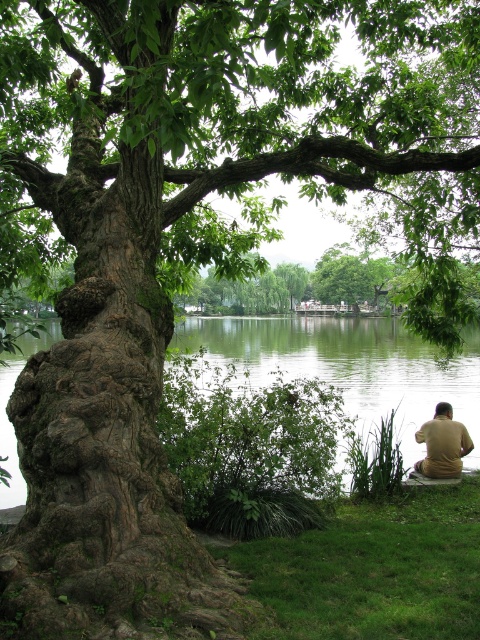
What do you see at coordinates (372, 570) in the screenshot? I see `green grass at lower right` at bounding box center [372, 570].

Does green grass at lower right have a lesser height compared to brown cotton shirt at lower right?

Indeed, green grass at lower right has a lesser height compared to brown cotton shirt at lower right.

Find the location of a particular element. The width and height of the screenshot is (480, 640). green grass at lower right is located at coordinates (372, 570).

Can you confirm if green grass at lower right is thinner than green liquid water at center?

No.

Does green grass at lower right appear on the right side of green liquid water at center?

Yes, green grass at lower right is to the right of green liquid water at center.

Between point (391, 541) and point (399, 337), which one is positioned in front?

Positioned in front is point (391, 541).

The height and width of the screenshot is (640, 480). In order to click on green grass at lower right in this screenshot , I will do point(372,570).

Is brown cotton shirt at lower right shorter than brown wooden bench at lower right?

Incorrect, brown cotton shirt at lower right's height does not fall short of brown wooden bench at lower right's.

Between brown cotton shirt at lower right and brown wooden bench at lower right, which one has less height?

With less height is brown wooden bench at lower right.

Find the location of a particular element. brown cotton shirt at lower right is located at coordinates (443, 444).